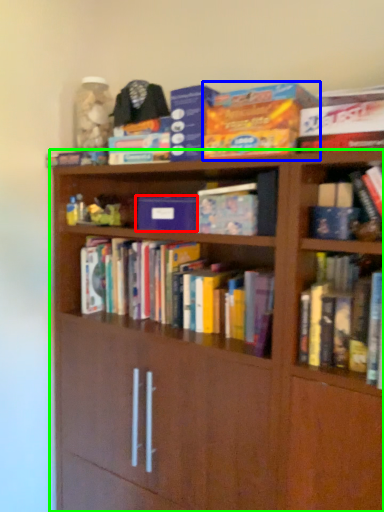
Question: Which object is the farthest from paperback book (highlighted by a red box)? Choose among these: paperback book (highlighted by a blue box) or bookcase (highlighted by a green box).

Choices:
 (A) paperback book
 (B) bookcase

Answer: (B)